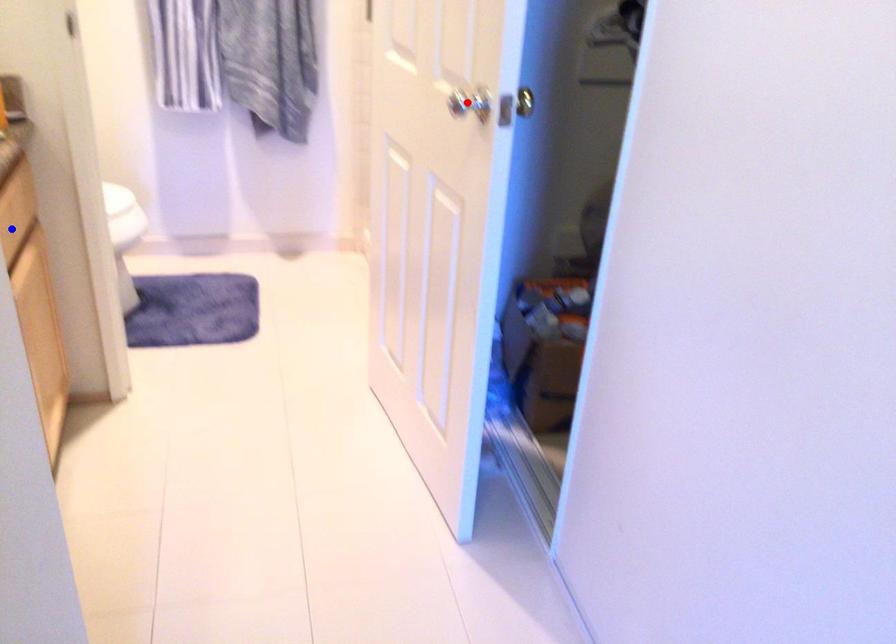
Question: Which of the two points in the image is closer to the camera?

Choices:
 (A) Blue point is closer.
 (B) Red point is closer.

Answer: (B)